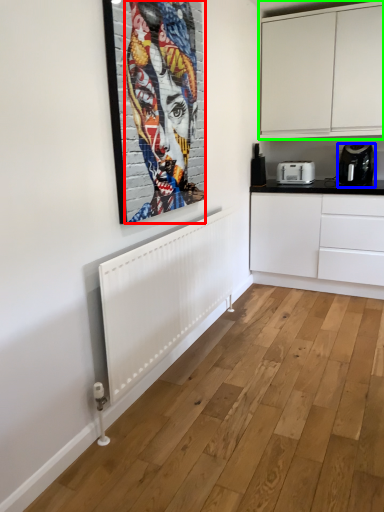
Question: Which object is positioned farthest from person (highlighted by a red box)? Select from home appliance (highlighted by a blue box) and cabinetry (highlighted by a green box).

Choices:
 (A) home appliance
 (B) cabinetry

Answer: (A)